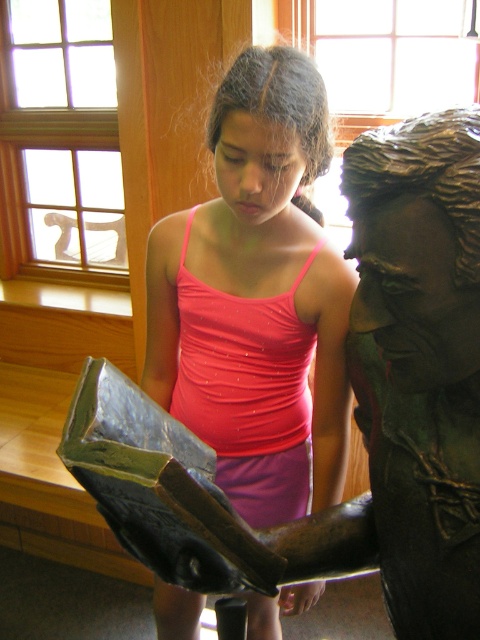
Question: Does bronze statue at center appear under pink matte tank top at center?

Choices:
 (A) yes
 (B) no

Answer: (A)

Question: Can you confirm if bronze statue at center is positioned to the left of pink matte tank top at center?

Choices:
 (A) no
 (B) yes

Answer: (A)

Question: Which object is farther from the camera taking this photo?

Choices:
 (A) pink matte tank top at center
 (B) bronze statue at center

Answer: (A)

Question: Can you confirm if bronze statue at center is smaller than pink matte tank top at center?

Choices:
 (A) yes
 (B) no

Answer: (A)